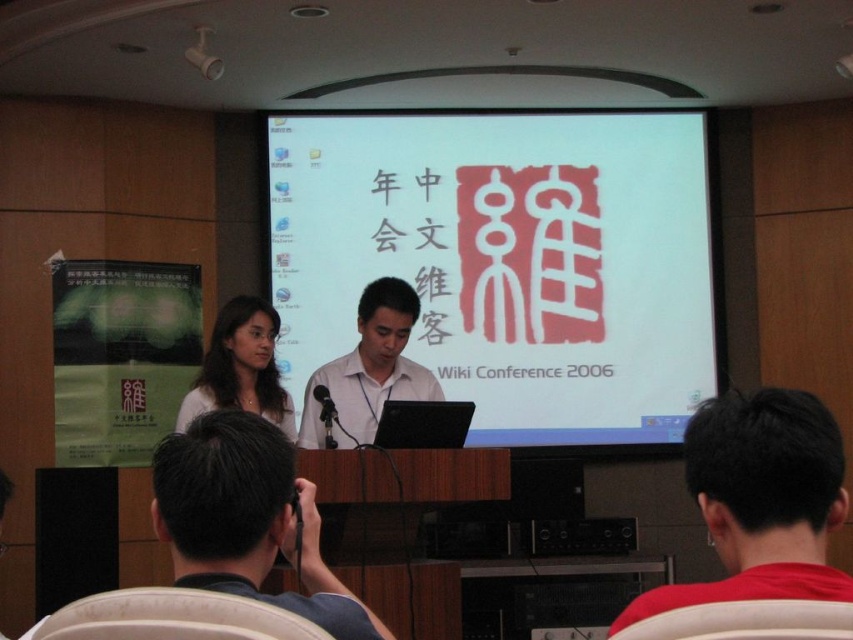
Which is behind, point (518, 440) or point (177, 470)?

Positioned behind is point (518, 440).

Between white paper at center and black fabric camera at lower center, which one is positioned higher?

Positioned higher is white paper at center.

Based on the photo, measure the distance between white paper at center and camera.

The distance of white paper at center from camera is 6.10 meters.

This screenshot has width=853, height=640. Find the location of `white paper at center`. white paper at center is located at coordinates (508, 260).

Locate an element on the screen. This screenshot has height=640, width=853. white paper at center is located at coordinates (508, 260).

Can you confirm if white paper at center is shorter than white matte shirt at center?

No, white paper at center is not shorter than white matte shirt at center.

This screenshot has width=853, height=640. Identify the location of white paper at center. (508, 260).

Does red matte shirt at lower right have a smaller size compared to smooth brown hair at center?

Correct, red matte shirt at lower right occupies less space than smooth brown hair at center.

Who is positioned more to the right, red matte shirt at lower right or smooth brown hair at center?

From the viewer's perspective, red matte shirt at lower right appears more on the right side.

What do you see at coordinates (761, 500) in the screenshot?
I see `red matte shirt at lower right` at bounding box center [761, 500].

You are a GUI agent. You are given a task and a screenshot of the screen. Output one action in this format:
    pyautogui.click(x=<x>, y=<y>)
    Task: Click on the red matte shirt at lower right
    The width and height of the screenshot is (853, 640).
    Given the screenshot: What is the action you would take?
    point(761,500)